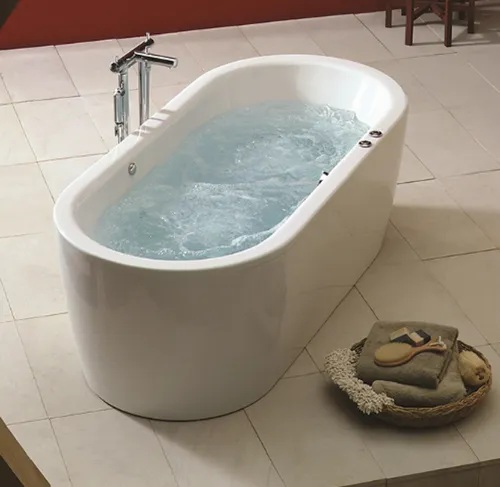
The image size is (500, 487). I want to click on tub of water, so click(x=230, y=175).